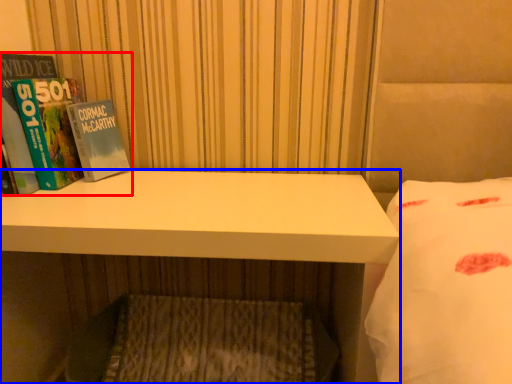
Question: Which point is closer to the camera, book (highlighted by a red box) or desk (highlighted by a blue box)?

Choices:
 (A) book
 (B) desk

Answer: (B)